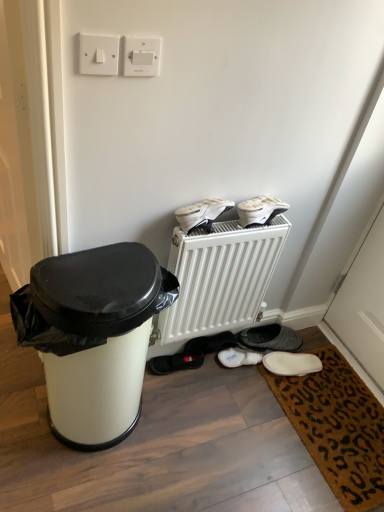
This screenshot has width=384, height=512. I want to click on vacant space in between white suede slippers at lower center, the first footwear when ordered from bottom to top, and white matte plastic trash can at left, so click(x=202, y=385).